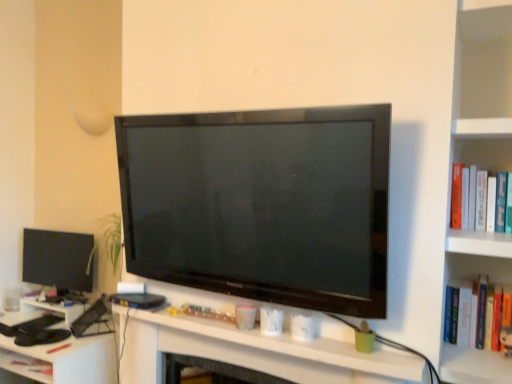
Question: Should I look upward or downward to see white plastic computer desk at lower left?

Choices:
 (A) down
 (B) up

Answer: (A)

Question: Could you tell me if matte black computer at center is turned towards matte black monitor at left?

Choices:
 (A) no
 (B) yes

Answer: (A)

Question: From the image's perspective, does matte black computer at center appear higher than matte black monitor at left?

Choices:
 (A) yes
 (B) no

Answer: (B)

Question: Could matte black monitor at left be considered to be inside matte black computer at center?

Choices:
 (A) yes
 (B) no

Answer: (B)

Question: Is matte black computer at center bigger than matte black monitor at left?

Choices:
 (A) yes
 (B) no

Answer: (B)

Question: From the image's perspective, is matte black computer at center under matte black monitor at left?

Choices:
 (A) no
 (B) yes

Answer: (B)

Question: Does matte black computer at center have a greater height compared to matte black monitor at left?

Choices:
 (A) no
 (B) yes

Answer: (A)

Question: Can you confirm if white plastic computer desk at lower left is positioned to the right of matte black computer at center?

Choices:
 (A) yes
 (B) no

Answer: (B)

Question: Can you confirm if white plastic computer desk at lower left is thinner than matte black computer at center?

Choices:
 (A) yes
 (B) no

Answer: (B)

Question: From the image's perspective, does white plastic computer desk at lower left appear lower than matte black computer at center?

Choices:
 (A) yes
 (B) no

Answer: (A)

Question: Is white plastic computer desk at lower left outside matte black computer at center?

Choices:
 (A) yes
 (B) no

Answer: (A)

Question: Can you confirm if white plastic computer desk at lower left is bigger than matte black computer at center?

Choices:
 (A) yes
 (B) no

Answer: (A)

Question: From the image's perspective, does white plastic computer desk at lower left appear higher than matte black computer at center?

Choices:
 (A) yes
 (B) no

Answer: (B)

Question: Is white plastic computer desk at lower left inside matte black computer at center?

Choices:
 (A) yes
 (B) no

Answer: (B)